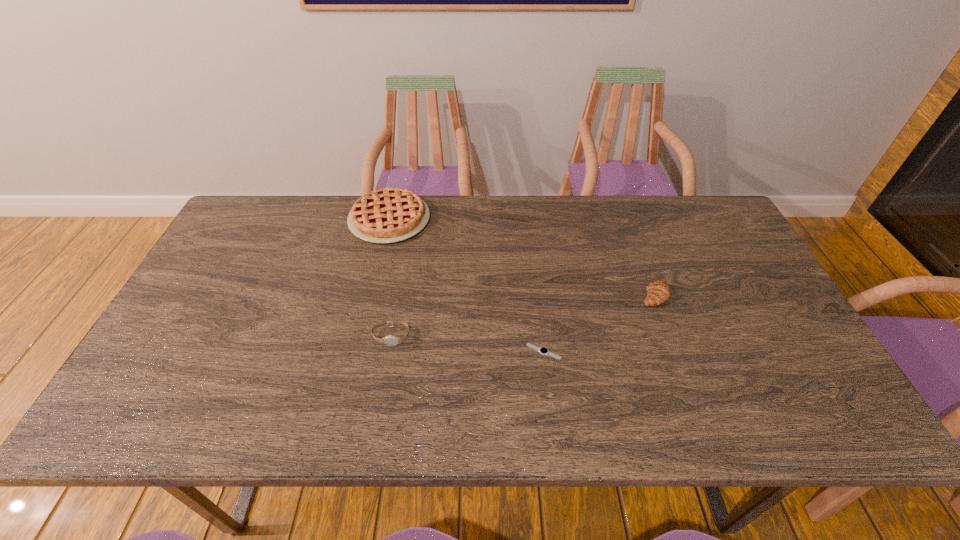
Locate an element on the screen. This screenshot has width=960, height=540. vacant region between the left watch and the third object from left to right is located at coordinates (468, 344).

I want to click on free space between the left watch and the tallest object, so click(x=391, y=278).

Identify the location of free spot between the farthest object and the second farthest object. The height and width of the screenshot is (540, 960). (522, 257).

I want to click on empty location between the shorter watch and the farthest object, so click(467, 286).

I want to click on vacant area between the crescent roll and the shortest object, so click(x=599, y=323).

This screenshot has width=960, height=540. What are the coordinates of `blank region between the farthest object and the third nearest object` in the screenshot? It's located at (522, 257).

Identify the location of blank region between the taller watch and the shortest object. (468, 344).

The width and height of the screenshot is (960, 540). Identify the location of free space between the shortest object and the crescent roll. (599, 323).

The height and width of the screenshot is (540, 960). Find the location of `free space between the crescent roll and the taller watch`. free space between the crescent roll and the taller watch is located at coordinates (523, 315).

Identify which object is the closest to the crescent roll. Please provide its 2D coordinates. Your answer should be formatted as a tuple, i.e. [(x, y)], where the tuple contains the x and y coordinates of a point satisfying the conditions above.

[(542, 350)]